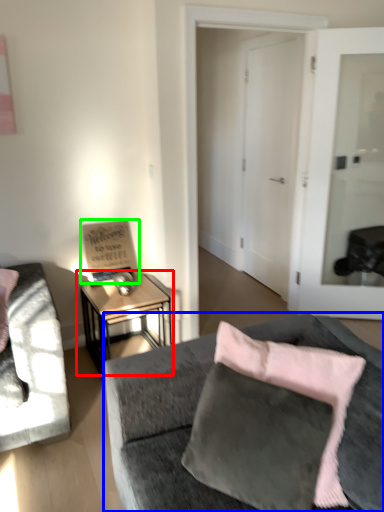
Question: Based on their relative distances, which object is farther from table (highlighted by a red box)? Choose from studio couch (highlighted by a blue box) and bulletin board (highlighted by a green box).

Choices:
 (A) studio couch
 (B) bulletin board

Answer: (A)